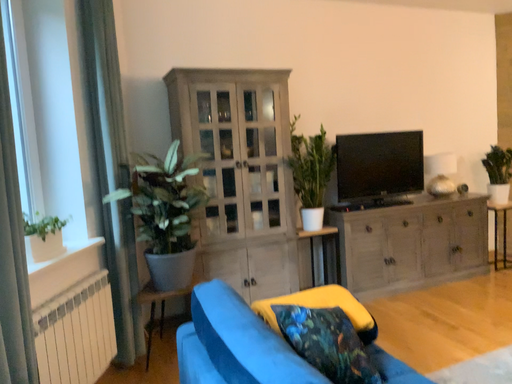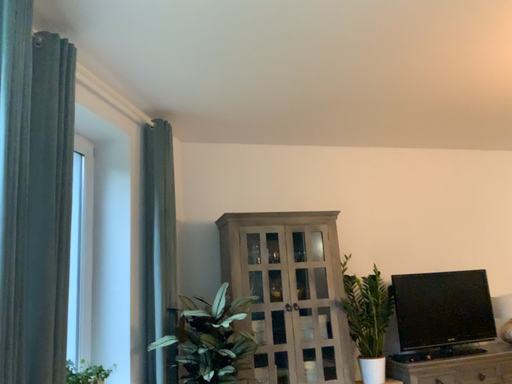
Question: Which way did the camera rotate in the video?

Choices:
 (A) rotated left
 (B) rotated right

Answer: (A)